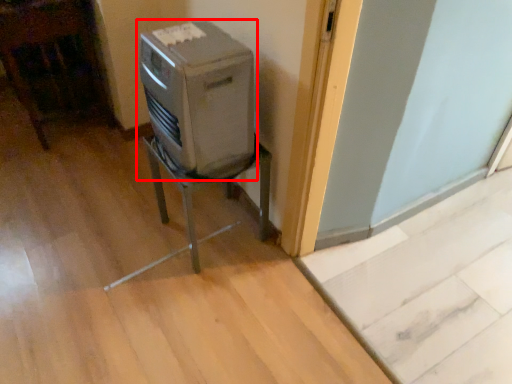
Question: In this image, where is home appliance (annotated by the red box) located relative to furniture?

Choices:
 (A) left
 (B) right

Answer: (A)